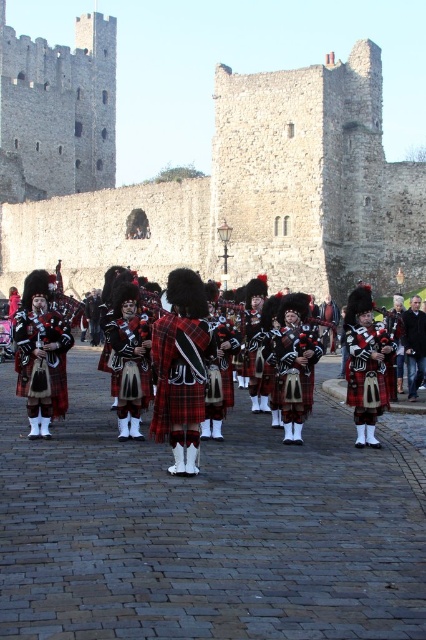
Question: Which point is closer to the camera?

Choices:
 (A) (181, 499)
 (B) (233, 214)
 (C) (34, 403)
 (D) (406, 371)

Answer: (A)

Question: Does stone wall at center appear over plaid fabric bagpipes at center?

Choices:
 (A) no
 (B) yes

Answer: (B)

Question: Which point appears closest to the camera in this image?

Choices:
 (A) (77, 472)
 (B) (420, 317)

Answer: (A)

Question: Which object is the farthest from the plaid fabric bagpipes at center?

Choices:
 (A) stone wall at center
 (B) red plaid kilt at left
 (C) dark blue leather jacket at center

Answer: (A)

Question: Can you confirm if plaid fabric bagpipes at center is positioned below red plaid kilt at left?

Choices:
 (A) yes
 (B) no

Answer: (A)

Question: Can you confirm if red plaid kilt at left is smaller than dark blue leather jacket at center?

Choices:
 (A) yes
 (B) no

Answer: (B)